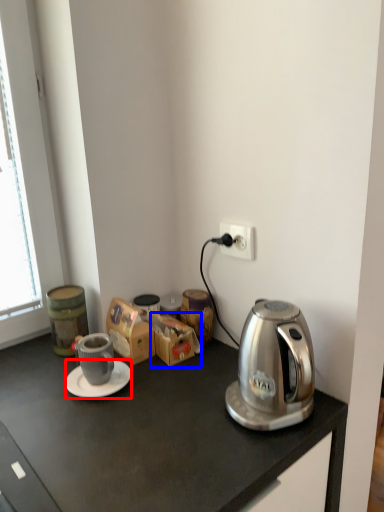
Question: Which object is closer to the camera taking this photo, saucer (highlighted by a red box) or cardboard box (highlighted by a blue box)?

Choices:
 (A) saucer
 (B) cardboard box

Answer: (A)